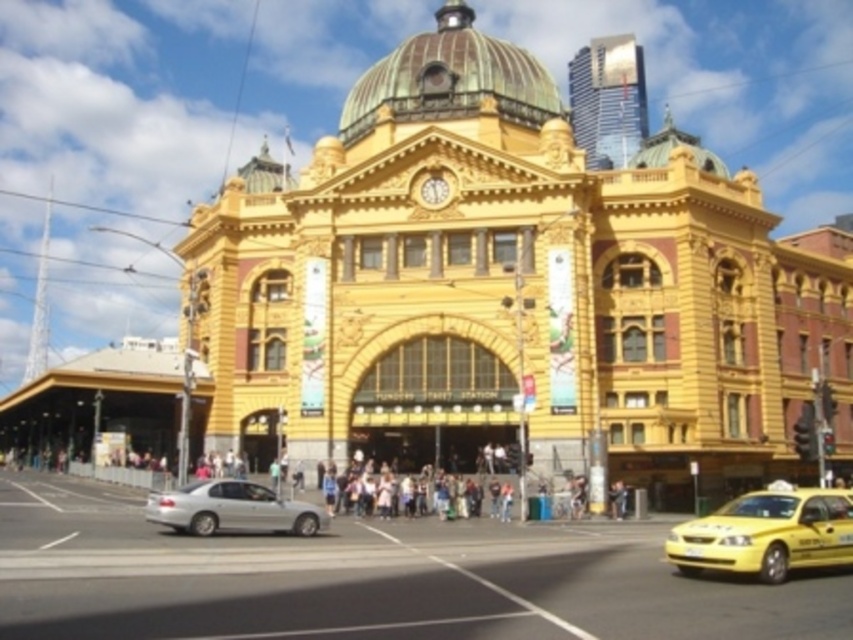
You are a pedestrian standing on the sidewalk in front of the yellow building. You see a yellow matte taxi at lower right and a satin silver sedan at lower left. Which vehicle is nearer to you?

The yellow matte taxi at lower right is closer to the viewer than the satin silver sedan at lower left.

In the scene shown: You are a pedestrian standing on the sidewalk in front of the yellow building with ornate architectural details. You see two taxis, the yellow metallic taxi at center and the yellow matte taxi at lower right. Which taxi is closer to the building?

The yellow metallic taxi at center is located above the yellow matte taxi at lower right, meaning it is closer to the building.